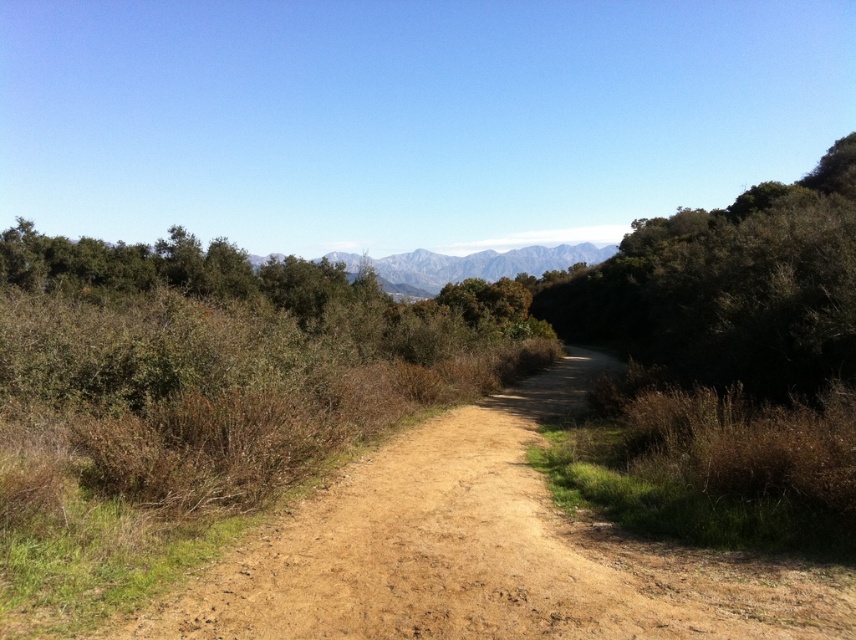
Question: Is dried dirt path at center bigger than gray rocky mountains at center?

Choices:
 (A) no
 (B) yes

Answer: (A)

Question: Among these points, which one is farthest from the camera?

Choices:
 (A) (563, 518)
 (B) (415, 266)

Answer: (B)

Question: Is dried dirt path at center to the left of gray rocky mountains at center from the viewer's perspective?

Choices:
 (A) no
 (B) yes

Answer: (B)

Question: Is dried dirt path at center positioned before gray rocky mountains at center?

Choices:
 (A) yes
 (B) no

Answer: (A)